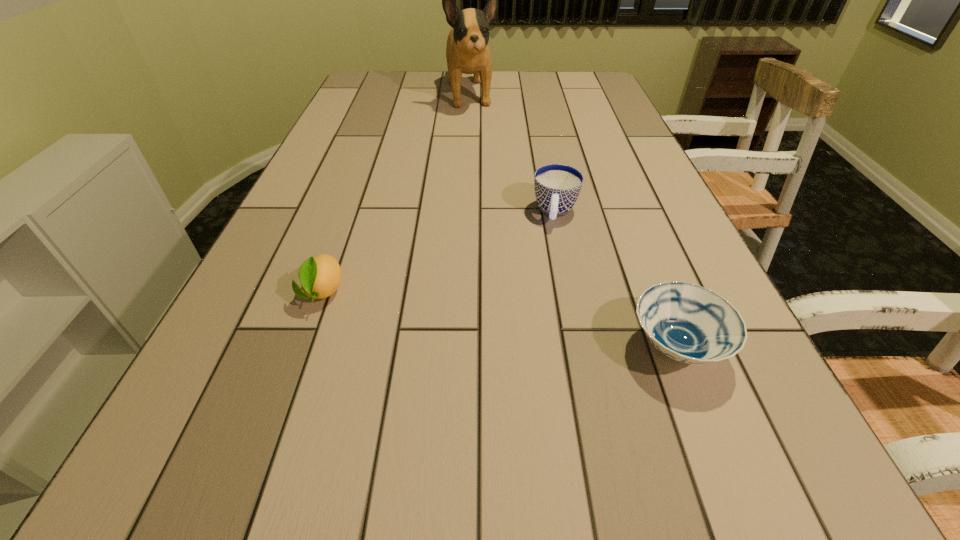
Identify the location of vacant area between the lemon and the farthest object. (396, 193).

Image resolution: width=960 pixels, height=540 pixels. I want to click on empty location between the puppy and the leftmost object, so click(x=396, y=193).

This screenshot has width=960, height=540. In order to click on vacant space that is in between the second object from right to left and the soup bowl in this screenshot , I will do `click(615, 280)`.

Where is `object that ranks as the closest to the third nearest object`? The image size is (960, 540). object that ranks as the closest to the third nearest object is located at coordinates (686, 322).

Identify the location of the closest object relative to the soup bowl. The height and width of the screenshot is (540, 960). (557, 187).

This screenshot has height=540, width=960. Find the location of `vacant position in the image that satisfies the following two spatial constraints: 1. with leaves positioned above the lemon; 2. on the right side of the rightmost object`. vacant position in the image that satisfies the following two spatial constraints: 1. with leaves positioned above the lemon; 2. on the right side of the rightmost object is located at coordinates pos(302,347).

This screenshot has height=540, width=960. Identify the location of free space that satisfies the following two spatial constraints: 1. with leaves positioned above the soup bowl; 2. on the right side of the lemon. (302, 347).